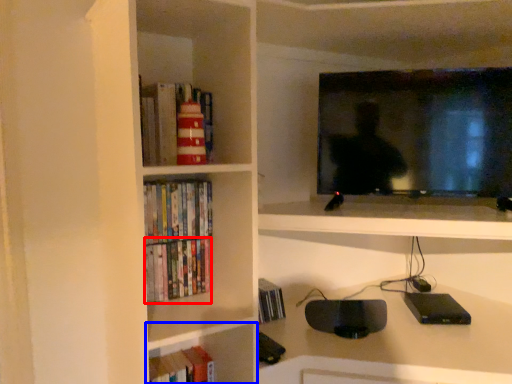
Question: Among these objects, which one is farthest to the camera, book (highlighted by a red box) or shelf (highlighted by a blue box)?

Choices:
 (A) book
 (B) shelf

Answer: (B)